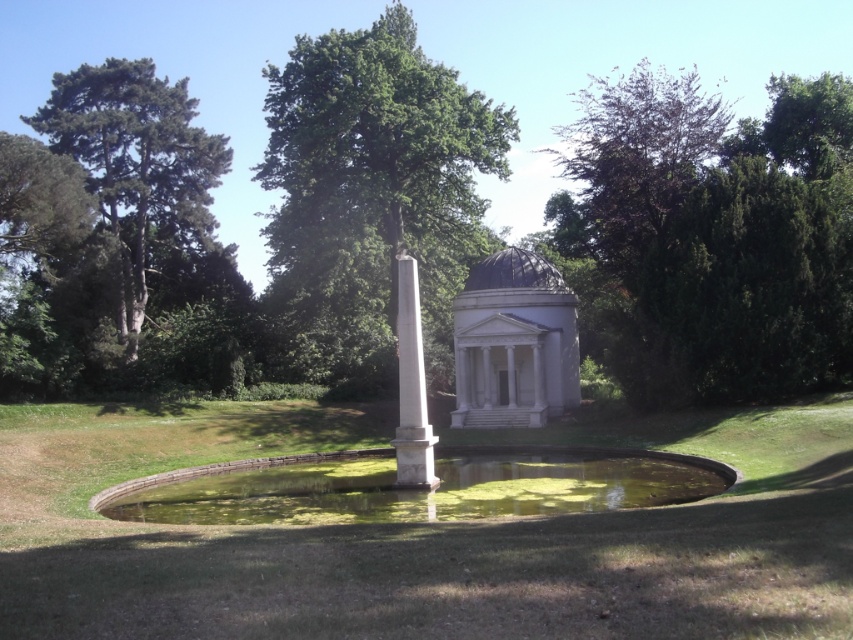
Question: Is green grass at center further to camera compared to white marble obelisk at center?

Choices:
 (A) no
 (B) yes

Answer: (A)

Question: Which object is positioned farthest from the green grass at center?

Choices:
 (A) purple-leaved tree at upper right
 (B) white marble obelisk at center
 (C) green algae water at center

Answer: (A)

Question: Considering the relative positions of green grass at center and white marble obelisk at center in the image provided, where is green grass at center located with respect to white marble obelisk at center?

Choices:
 (A) left
 (B) right

Answer: (A)

Question: Which point appears farthest from the camera in this image?

Choices:
 (A) (761, 385)
 (B) (482, 237)

Answer: (B)

Question: Which of the following is the farthest from the observer?

Choices:
 (A) green leafy tree at upper center
 (B) green algae water at center
 (C) purple-leaved tree at upper right
 (D) green grass at center

Answer: (A)

Question: Does green leafy tree at upper center appear under green leafy tree at left?

Choices:
 (A) no
 (B) yes

Answer: (A)